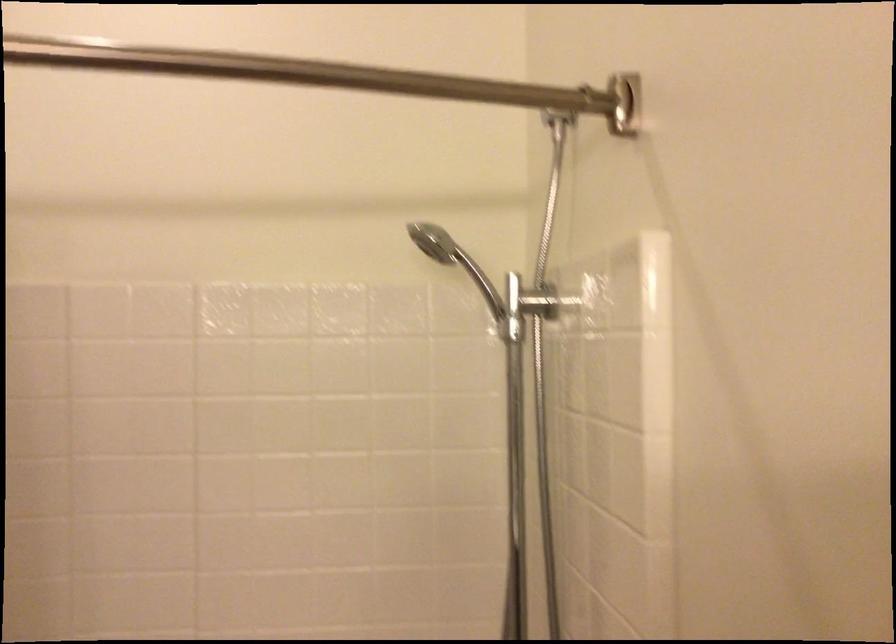
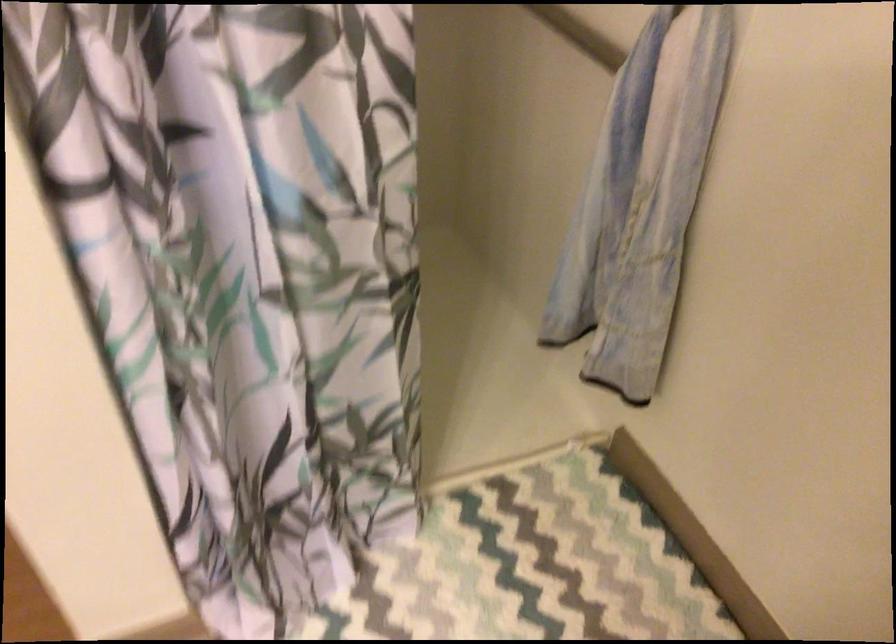
First-person continuous shooting, in which direction is the camera rotating?

The camera's rotation is toward right-down.